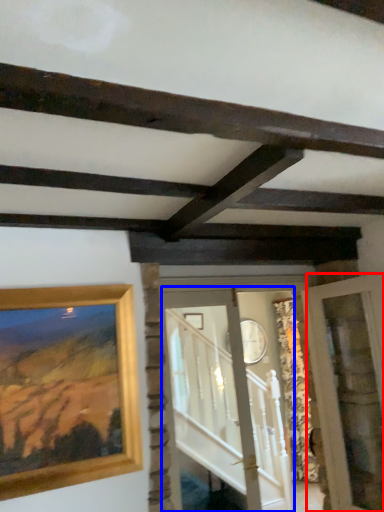
Question: Which object appears closest to the camera in this image, glass door (highlighted by a red box) or glass door (highlighted by a blue box)?

Choices:
 (A) glass door
 (B) glass door

Answer: (A)